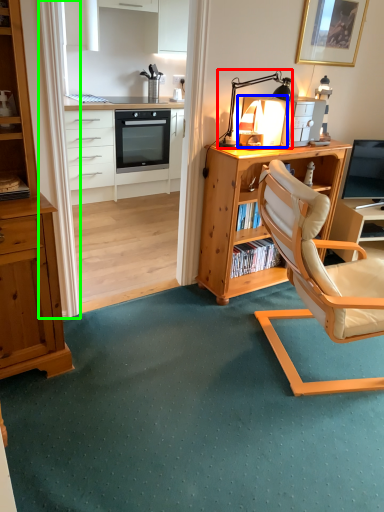
Question: Estimate the real-world distances between objects in this image. Which object is farther from table lamp (highlighted by a red box), appliance (highlighted by a blue box) or curtain (highlighted by a green box)?

Choices:
 (A) appliance
 (B) curtain

Answer: (B)